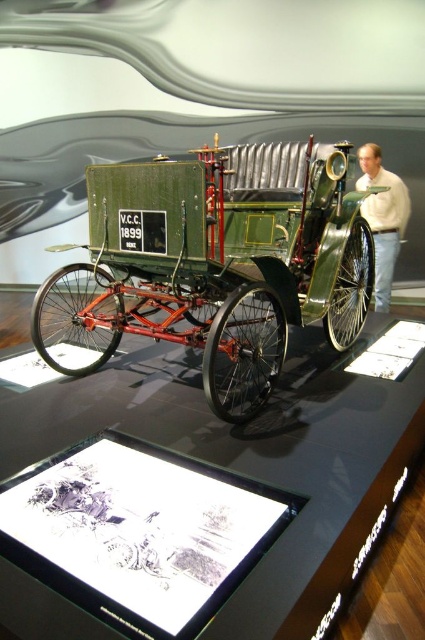
You are a photographer taking a picture of the vintage car in the museum. You notice two points on the car, one at coordinate point (175,240) and another at point (380,260). If you want to focus on the part of the car closest to you, which point should you aim your camera at?

You should aim your camera at point (175,240) because it is closer to the camera than point (380,260).

You are a tour guide leading a group through the museum. You need to inform visitors about the distance between the green matte wagon at center and the light beige sweater at right. What do you tell them?

The green matte wagon at center is 2.09 meters away from the light beige sweater at right.

You are a museum visitor standing in front of the vintage car exhibit. You notice the green matte wagon at center and the light beige sweater at right. Which object is closer to you?

The green matte wagon at center is closer to you because it is in front of the light beige sweater at right.